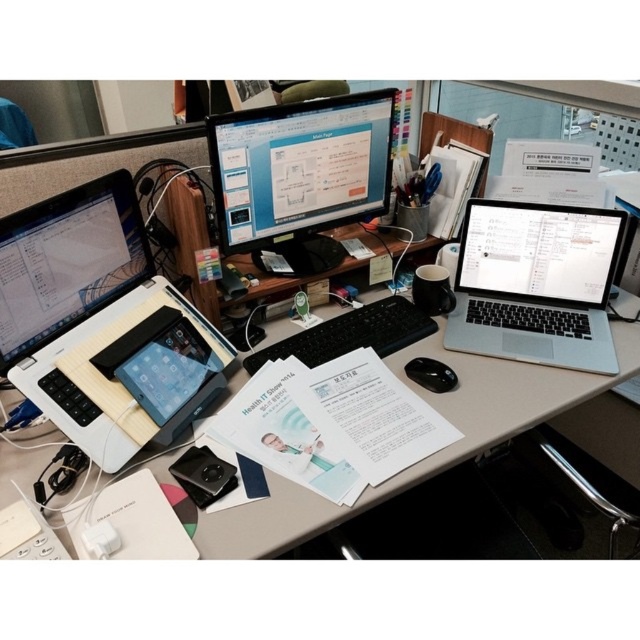
Between silver metallic laptop at right and matte black monitor at center, which one is positioned lower?

silver metallic laptop at right is lower down.

Can you confirm if silver metallic laptop at right is thinner than matte black monitor at center?

No.

The height and width of the screenshot is (640, 640). I want to click on silver metallic laptop at right, so click(536, 284).

At what (x,y) coordinates should I click in order to perform the action: click on silver metallic laptop at right. Please return your answer as a coordinate pair (x, y). Image resolution: width=640 pixels, height=640 pixels. Looking at the image, I should click on (536, 284).

Is silver metallic laptop at right to the right of black matte keyboard at center from the viewer's perspective?

Yes, silver metallic laptop at right is to the right of black matte keyboard at center.

Between point (518, 337) and point (392, 317), which one is positioned behind?

The point (392, 317) is more distant.

Locate an element on the screen. This screenshot has width=640, height=640. silver metallic laptop at right is located at coordinates (536, 284).

Does matte black monitor at center have a greater width compared to black matte mouse at center?

Correct, the width of matte black monitor at center exceeds that of black matte mouse at center.

Which of these two, matte black monitor at center or black matte mouse at center, stands taller?

Standing taller between the two is matte black monitor at center.

Which is in front, point (378, 150) or point (440, 384)?

Point (440, 384)

The height and width of the screenshot is (640, 640). I want to click on matte black monitor at center, so click(300, 168).